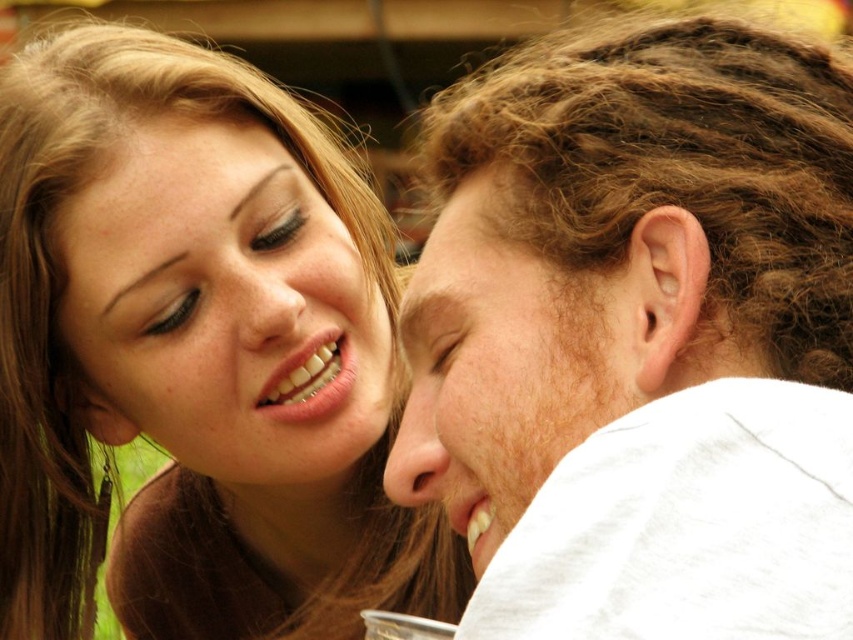
Question: Is smooth skin face at upper left bigger than matte skin forehead at upper left?

Choices:
 (A) no
 (B) yes

Answer: (B)

Question: Is smooth skin face at upper left bigger than light brown curly hair at right?

Choices:
 (A) no
 (B) yes

Answer: (B)

Question: Which of these objects is positioned farthest from the smooth skin face at upper left?

Choices:
 (A) smooth brown hair at upper left
 (B) light brown curly hair at right
 (C) light brown hair at right
 (D) matte skin forehead at upper left

Answer: (B)

Question: Is light brown hair at right positioned before matte skin forehead at upper left?

Choices:
 (A) yes
 (B) no

Answer: (A)

Question: Which point is farther to the camera?

Choices:
 (A) smooth brown hair at upper left
 (B) light brown curly hair at right
 (C) light brown hair at right
 (D) matte skin forehead at upper left

Answer: (A)

Question: Which of the following is the closest to the observer?

Choices:
 (A) light brown hair at right
 (B) smooth skin face at upper left

Answer: (A)